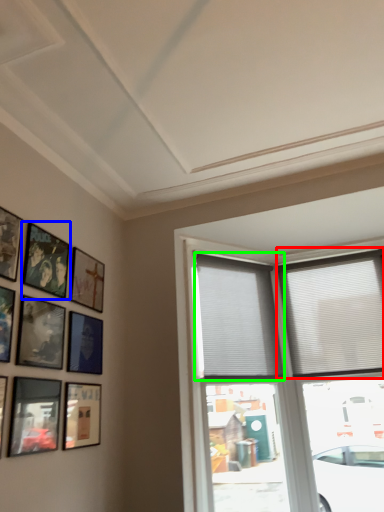
Question: Which object is the farthest from window (highlighted by a red box)? Choose among these: picture frame (highlighted by a blue box) or window (highlighted by a green box).

Choices:
 (A) picture frame
 (B) window

Answer: (A)